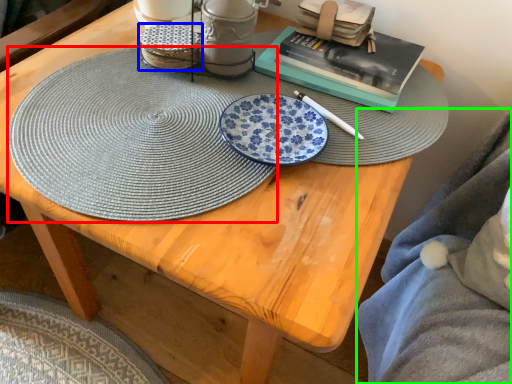
Question: Which is nearer to the platter (highlighted by a red box)? tableware (highlighted by a blue box) or blanket (highlighted by a green box).

Choices:
 (A) tableware
 (B) blanket

Answer: (A)